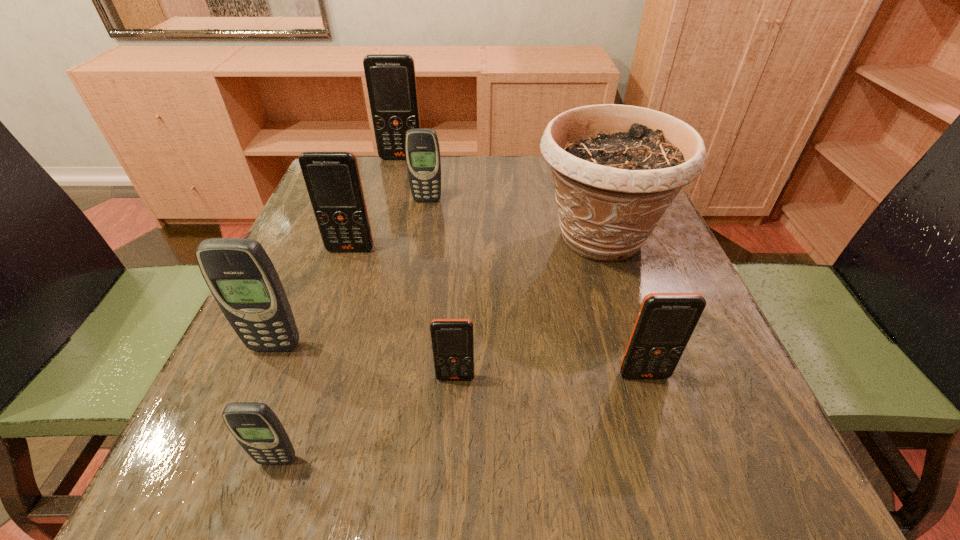
The image size is (960, 540). Identify the location of the farthest object. (391, 80).

You are a GUI agent. You are given a task and a screenshot of the screen. Output one action in this format:
    pyautogui.click(x=<x>, y=<y>)
    Task: Click on the biggest orange cellular telephone
    
    Given the screenshot: What is the action you would take?
    pyautogui.click(x=391, y=80)

Locate an element on the screen. Image resolution: width=960 pixels, height=540 pixels. flowerpot is located at coordinates (616, 168).

You are a GUI agent. You are given a task and a screenshot of the screen. Output one action in this format:
    pyautogui.click(x=<x>, y=<y>)
    Task: Click on the third nearest orange cellular telephone
    The height and width of the screenshot is (540, 960).
    Given the screenshot: What is the action you would take?
    pyautogui.click(x=332, y=178)

This screenshot has width=960, height=540. I want to click on the fifth nearest cellular telephone, so click(x=332, y=178).

At what (x,y) coordinates should I click in order to perform the action: click on the second nearest gray cellular telephone. Please return your answer as a coordinate pair (x, y). Looking at the image, I should click on (240, 275).

You are a GUI agent. You are given a task and a screenshot of the screen. Output one action in this format:
    pyautogui.click(x=<x>, y=<y>)
    Task: Click on the biggest gray cellular telephone
    
    Given the screenshot: What is the action you would take?
    pyautogui.click(x=240, y=275)

Where is `the second biggest gray cellular telephone`? This screenshot has width=960, height=540. the second biggest gray cellular telephone is located at coordinates (422, 150).

Locate an element on the screen. Image resolution: width=960 pixels, height=540 pixels. the sixth nearest cellular telephone is located at coordinates (422, 150).

The image size is (960, 540). I want to click on the rightmost cellular telephone, so click(x=665, y=322).